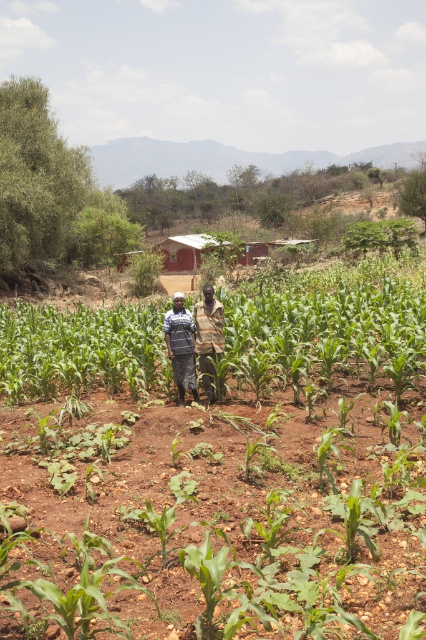
You are a photographer trying to capture both the dark blue shirt at center and the camouflage fabric shirt at center in a single frame. Based on their sizes, which one should you adjust your camera focus to prioritize to ensure both are in focus?

The dark blue shirt at center is smaller than the camouflage fabric shirt at center, so you should focus on the camouflage fabric shirt at center to ensure both are in focus.

You are a photographer trying to capture a clear shot of the dark blue shirt at center and the green leafy corn at center. Based on their positions, which object is blocking the view of the other?

The green leafy corn at center is positioned over the dark blue shirt at center, so it is blocking the view of the dark blue shirt at center.